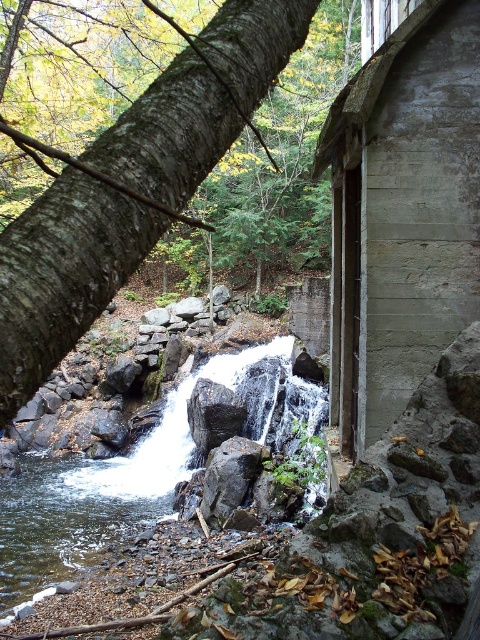
You are a hiker standing at the edge of the stream. You see the white smooth water at center and the gray rough rock at center. Which one is closer to you?

The white smooth water at center is closer to you because it is in front of the gray rough rock at center.

You are standing at the edge of the stream and want to place a 10 feet long wooden board between the white smooth water at center and the smooth gray rock at center. Will the board reach both ends without bending?

The distance between the white smooth water at center and the smooth gray rock at center is 11.32 feet. Since the wooden board is 10 feet long, it will not be long enough to span the entire distance between them. You would need a board at least 11.32 feet long to cover the gap without bending.